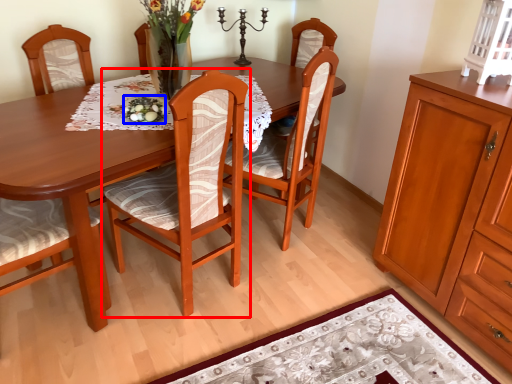
Question: Which object is closer to the camera taking this photo, chair (highlighted by a red box) or food (highlighted by a blue box)?

Choices:
 (A) chair
 (B) food

Answer: (A)